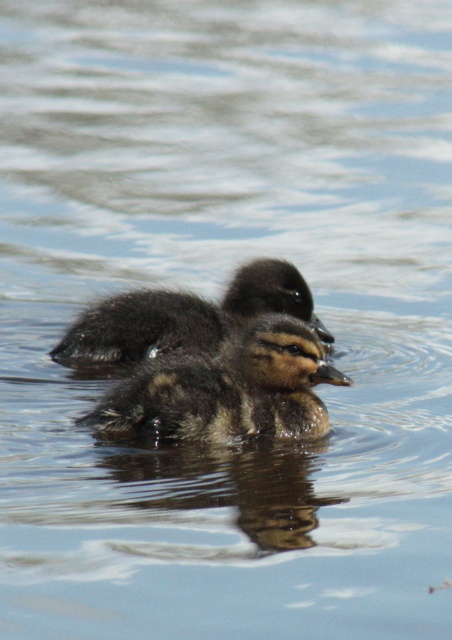
Question: Does brown fuzzy duckling at center appear on the right side of dark brown fluffy duckling at center?

Choices:
 (A) no
 (B) yes

Answer: (B)

Question: Does brown fuzzy duckling at center appear on the left side of dark brown fluffy duckling at center?

Choices:
 (A) yes
 (B) no

Answer: (B)

Question: Is brown fuzzy duckling at center behind dark brown fluffy duckling at center?

Choices:
 (A) no
 (B) yes

Answer: (A)

Question: Which object appears farthest from the camera in this image?

Choices:
 (A) brown fuzzy duckling at center
 (B) dark brown fluffy duckling at center

Answer: (B)

Question: Which point is farther to the camera?

Choices:
 (A) brown fuzzy duckling at center
 (B) dark brown fluffy duckling at center

Answer: (B)